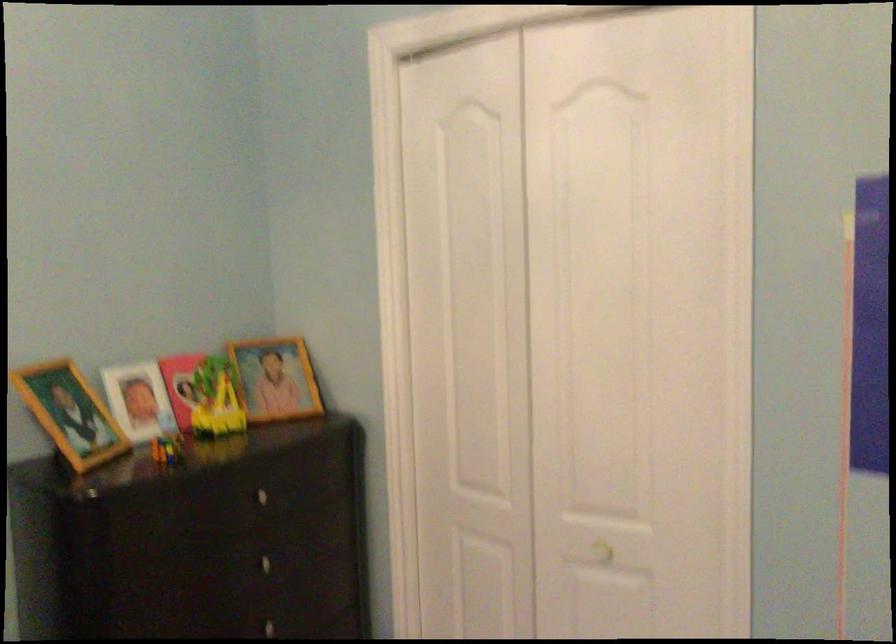
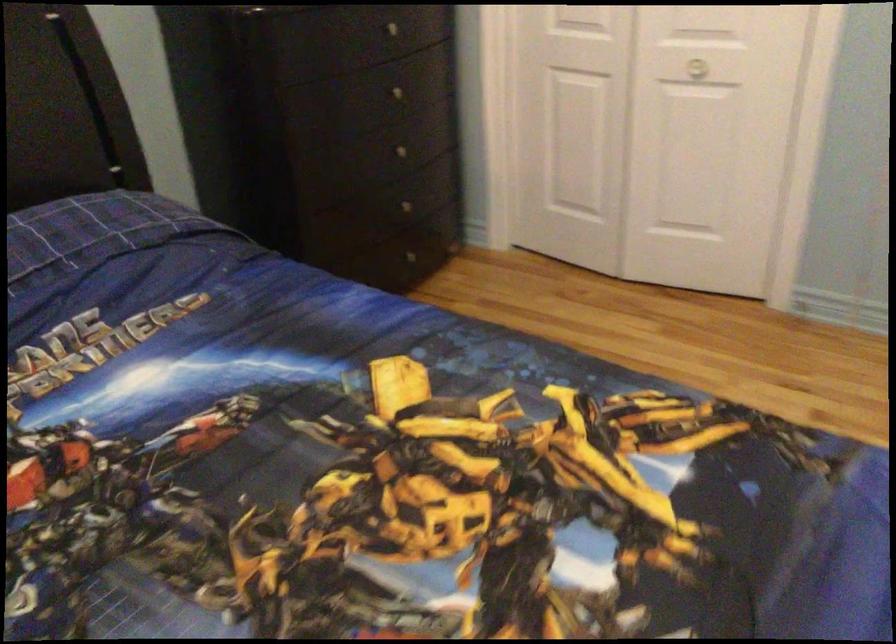
From the picture: Which direction would the cameraman need to move to produce the second image?

The cameraman moved toward left, backward.